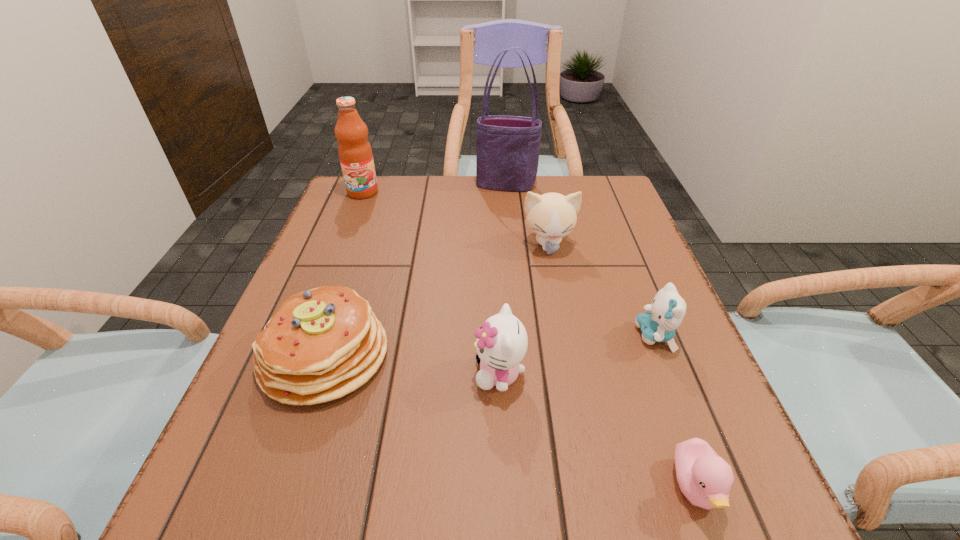
The width and height of the screenshot is (960, 540). In order to click on the tallest object in this screenshot , I will do `click(508, 147)`.

Find the location of a particular element. fruit juice is located at coordinates tap(355, 153).

Where is `the third farthest object`? Image resolution: width=960 pixels, height=540 pixels. the third farthest object is located at coordinates (551, 216).

Find the location of a particular element. the farthest kitten is located at coordinates (551, 216).

Where is `the leftmost kitten`? The width and height of the screenshot is (960, 540). the leftmost kitten is located at coordinates (501, 344).

Where is `the rightmost kitten`? the rightmost kitten is located at coordinates (658, 324).

At what (x,y) coordinates should I click in order to perform the action: click on pancake. Please return your answer as a coordinate pair (x, y). Image resolution: width=960 pixels, height=540 pixels. Looking at the image, I should click on (322, 344).

Locate an element on the screen. Image resolution: width=960 pixels, height=540 pixels. the shortest object is located at coordinates (705, 479).

Where is `duckling`? duckling is located at coordinates (705, 479).

The width and height of the screenshot is (960, 540). I want to click on free space located on the right of the tote bag, so click(574, 185).